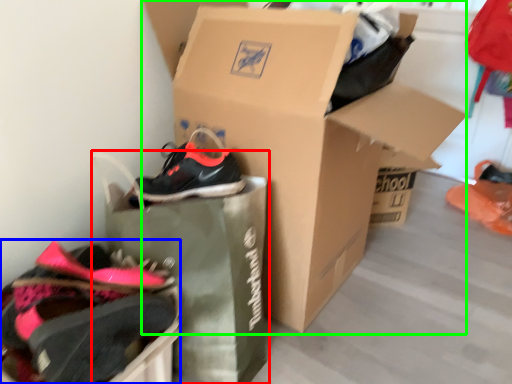
Question: Based on their relative distances, which object is farther from shopping bag (highlighted by a red box)? Choose from footwear (highlighted by a blue box) and box (highlighted by a green box).

Choices:
 (A) footwear
 (B) box

Answer: (B)